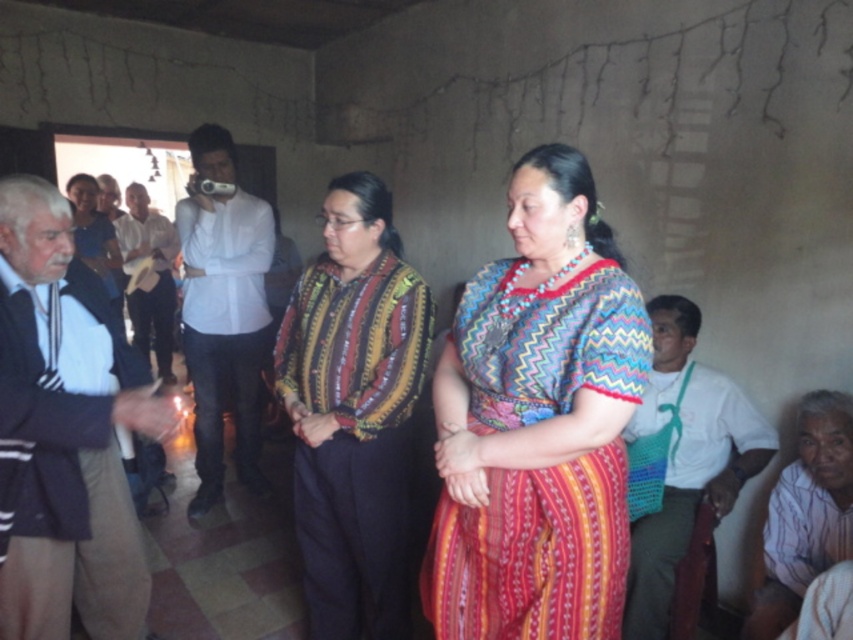
Consider the image. You are standing in the rustic indoor setting described. There is a point at coordinates (537,422). What object is located at this point?

The point at coordinates (537,422) corresponds to the multicolored woven dress at center.

You are organizing a clothing donation drive and need to determine which item is shorter between the dark gray sweater at left and the white cotton shirt at center. Based on the scene description, which one should you list as shorter?

The dark gray sweater at left is shorter than the white cotton shirt at center according to the description.